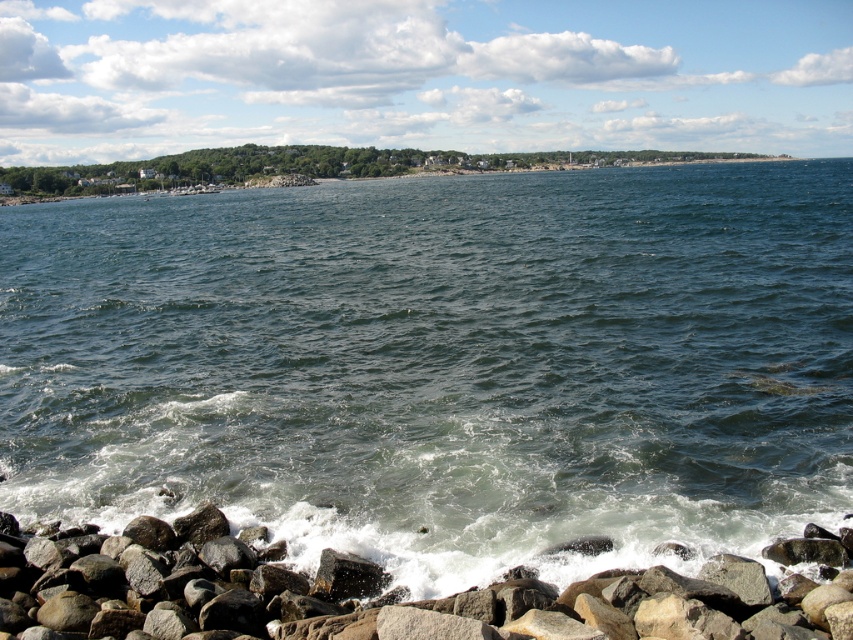
Question: Is dark blue water at center above gray rock at lower left?

Choices:
 (A) no
 (B) yes

Answer: (B)

Question: Among these points, which one is farthest from the camera?

Choices:
 (A) (219, 532)
 (B) (128, 417)

Answer: (B)

Question: Among these points, which one is farthest from the camera?

Choices:
 (A) (33, 451)
 (B) (55, 564)

Answer: (A)

Question: Does dark blue water at center lie behind gray rock at lower left?

Choices:
 (A) yes
 (B) no

Answer: (A)

Question: Is dark blue water at center wider than gray rock at lower left?

Choices:
 (A) no
 (B) yes

Answer: (B)